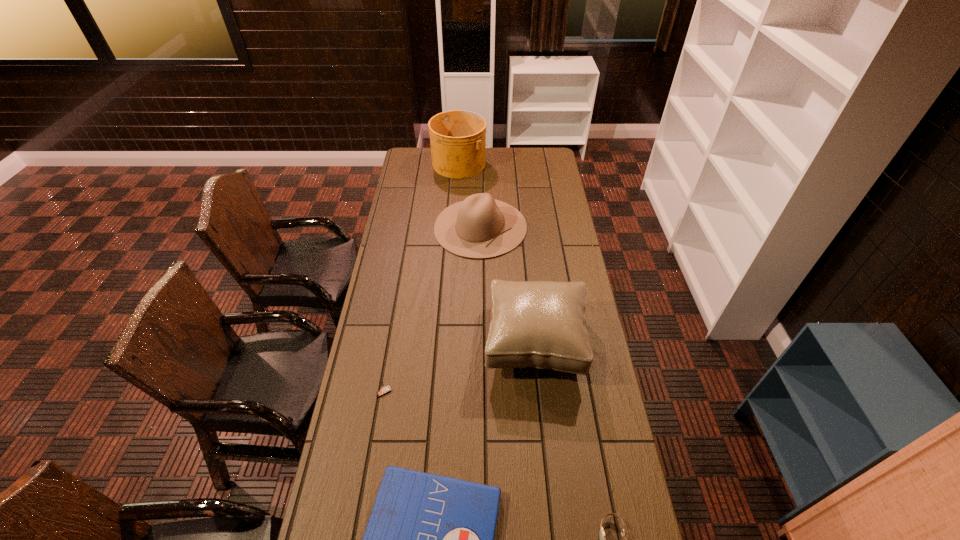
What are the coordinates of `the farthest object` in the screenshot? It's located at (457, 137).

The image size is (960, 540). I want to click on cushion, so click(x=541, y=324).

You are a GUI agent. You are given a task and a screenshot of the screen. Output one action in this format:
    pyautogui.click(x=<x>, y=<y>)
    Task: Click on the fourth shortest object
    The width and height of the screenshot is (960, 540).
    Given the screenshot: What is the action you would take?
    pyautogui.click(x=479, y=227)

The image size is (960, 540). Find the location of `sombrero`. sombrero is located at coordinates (479, 227).

Locate an element on the screen. The width and height of the screenshot is (960, 540). the fourth tallest object is located at coordinates (384, 389).

The width and height of the screenshot is (960, 540). Identify the location of free spot located on the right of the farthest object. (498, 163).

Find the location of a particular element. The width and height of the screenshot is (960, 540). free space located 0.280m on the left of the cushion is located at coordinates (410, 340).

I want to click on free location located 0.050m on the back of the sombrero, so click(x=480, y=193).

This screenshot has height=540, width=960. Identify the location of free space located 0.300m on the back of the third shortest object. (396, 318).

Find the location of a particular element. The width and height of the screenshot is (960, 540). object located in the far edge section of the desktop is located at coordinates (457, 137).